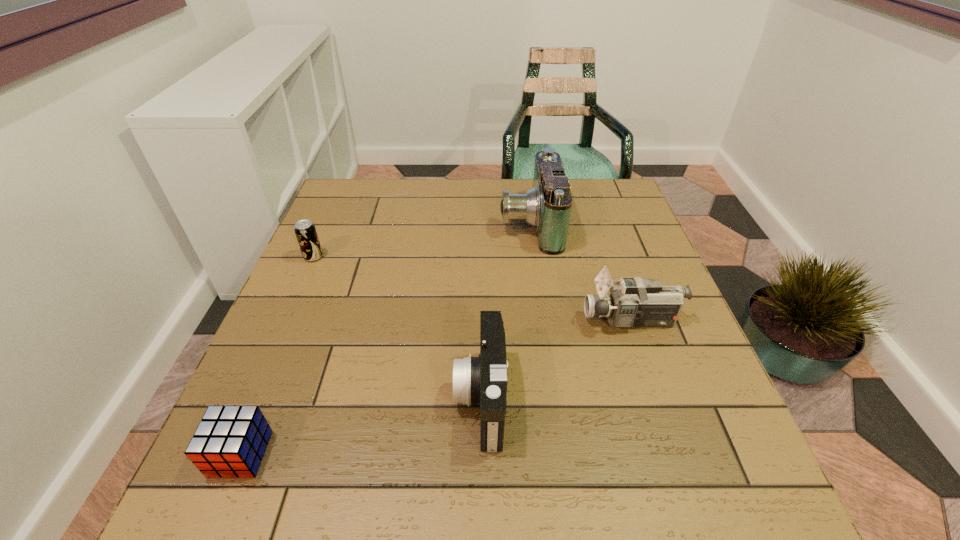
The width and height of the screenshot is (960, 540). In order to click on the farthest camcorder in this screenshot , I will do `click(547, 206)`.

Where is `the tallest camcorder`? This screenshot has width=960, height=540. the tallest camcorder is located at coordinates (547, 206).

Where is `the third farthest object`? the third farthest object is located at coordinates (635, 302).

Where is `the second nearest camcorder`? the second nearest camcorder is located at coordinates (635, 302).

What are the coordinates of `the leftmost camcorder` in the screenshot? It's located at (482, 381).

The width and height of the screenshot is (960, 540). I want to click on the nearest camcorder, so click(x=482, y=381).

Locate an element on the screen. The height and width of the screenshot is (540, 960). the second shortest object is located at coordinates (305, 231).

The height and width of the screenshot is (540, 960). I want to click on cube, so click(230, 441).

This screenshot has width=960, height=540. Find the location of `free space located on the front-facing side of the tallest object`. free space located on the front-facing side of the tallest object is located at coordinates pos(468,223).

This screenshot has height=540, width=960. Find the location of `vacant space located 0.110m on the front-facing side of the tallest object`. vacant space located 0.110m on the front-facing side of the tallest object is located at coordinates (461, 223).